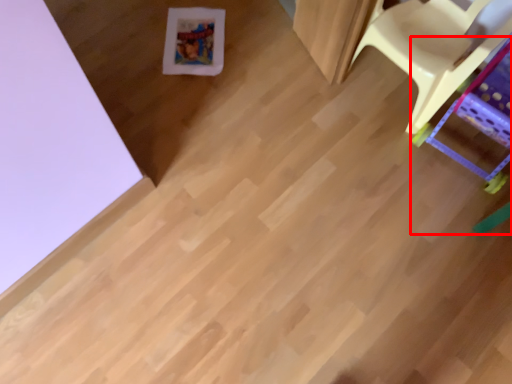
Question: From the image's perspective, considering the relative positions of furniture (annotated by the red box) and furniture in the image provided, where is furniture (annotated by the red box) located with respect to the staircase?

Choices:
 (A) below
 (B) above

Answer: (A)